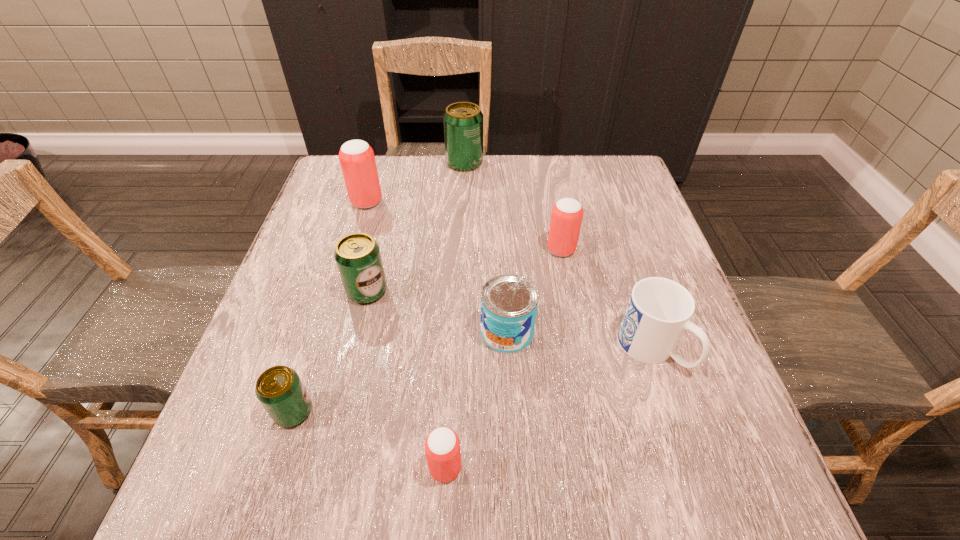
What are the coordinates of `vacant area situated on the left of the can` in the screenshot? It's located at (329, 332).

I want to click on vacant area located on the back of the second nearest object, so click(x=340, y=264).

This screenshot has width=960, height=540. Identify the location of free spot located on the back of the nearest object. (450, 371).

Image resolution: width=960 pixels, height=540 pixels. Identify the location of object that is at the near edge. (442, 446).

This screenshot has width=960, height=540. Identify the location of object at the right edge. (659, 310).

Locate an element on the screen. object located in the far left corner section of the desktop is located at coordinates (357, 159).

What are the coordinates of `vacant area at the far edge` in the screenshot? It's located at (522, 198).

The height and width of the screenshot is (540, 960). In the image, there is a desktop. In order to click on free space at the near edge in this screenshot , I will do `click(459, 481)`.

In the image, there is a desktop. Identify the location of vacant region at the left edge. (216, 436).

Identify the location of free spot at the right edge of the desktop. The width and height of the screenshot is (960, 540). (609, 227).